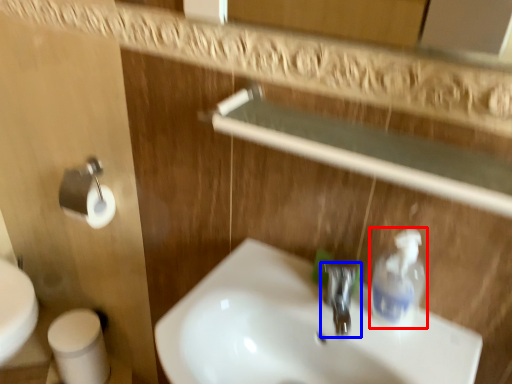
Question: Which object is further to the camera taking this photo, cleaning product (highlighted by a red box) or tap (highlighted by a blue box)?

Choices:
 (A) cleaning product
 (B) tap

Answer: (B)